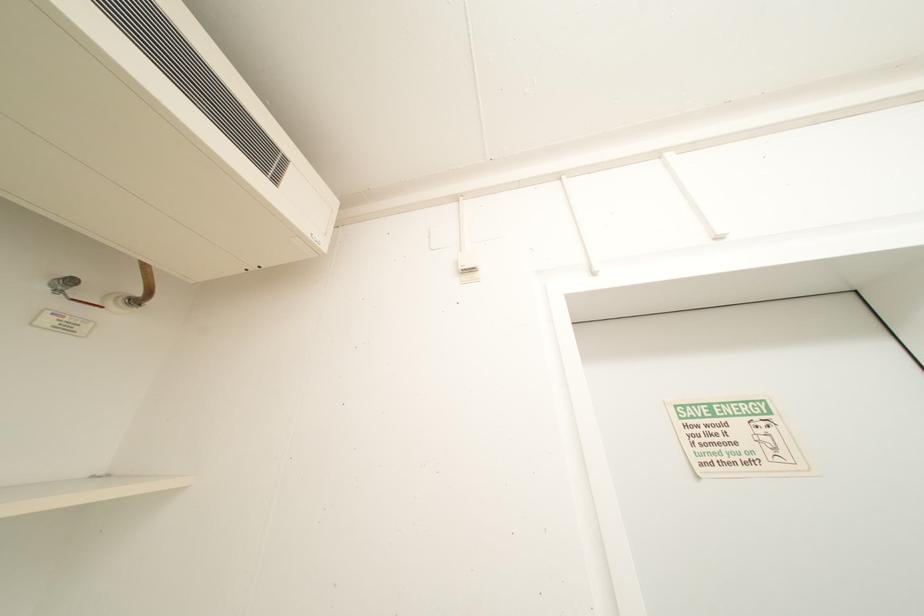
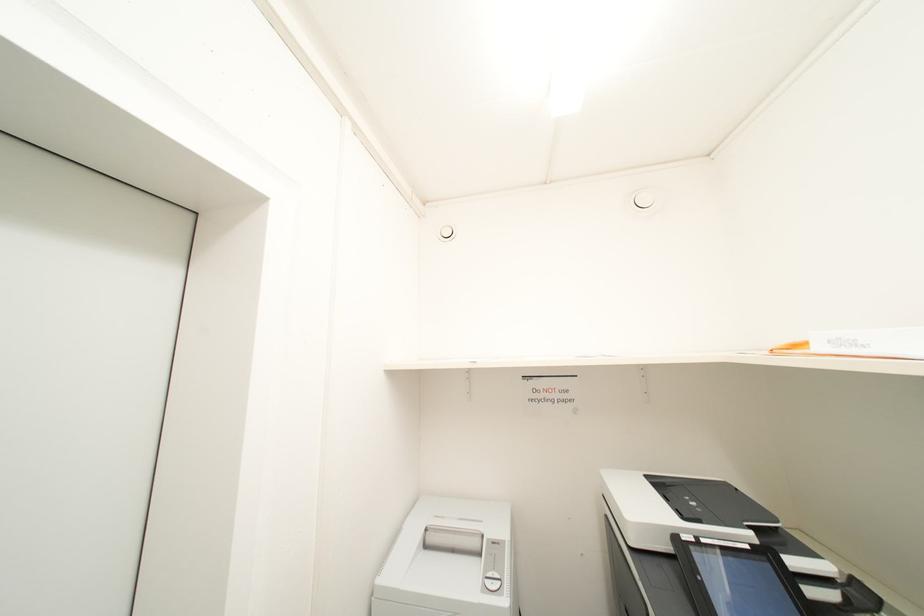
Question: The first image is from the beginning of the video and the second image is from the end. How did the camera likely rotate when shooting the video?

Choices:
 (A) Left
 (B) Right
 (C) Up
 (D) Down

Answer: (B)